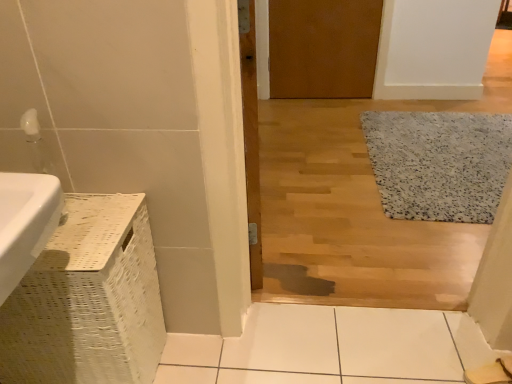
The image size is (512, 384). I want to click on vacant area located to the right-hand side of brown matte door at upper center, marked as the second door in a left-to-right arrangement, so click(x=362, y=107).